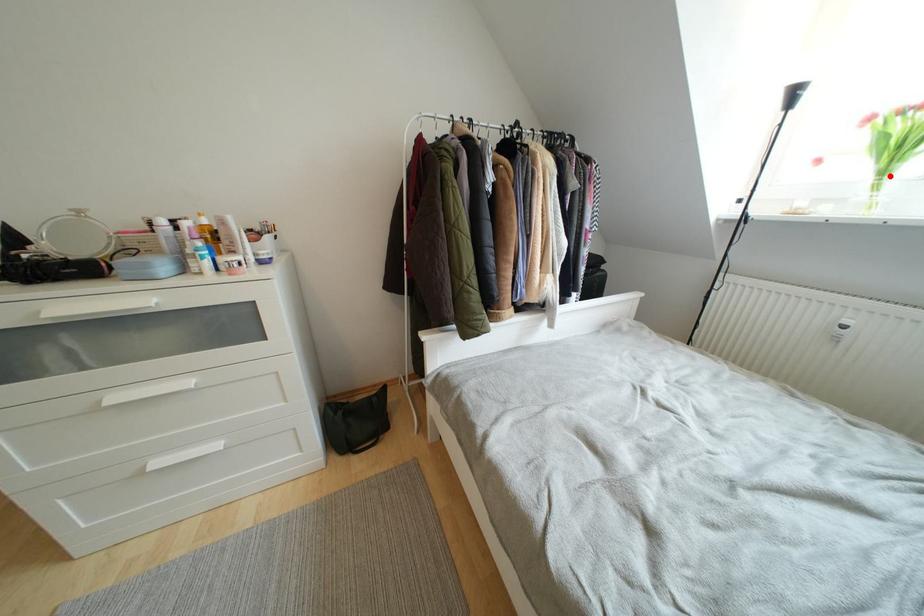
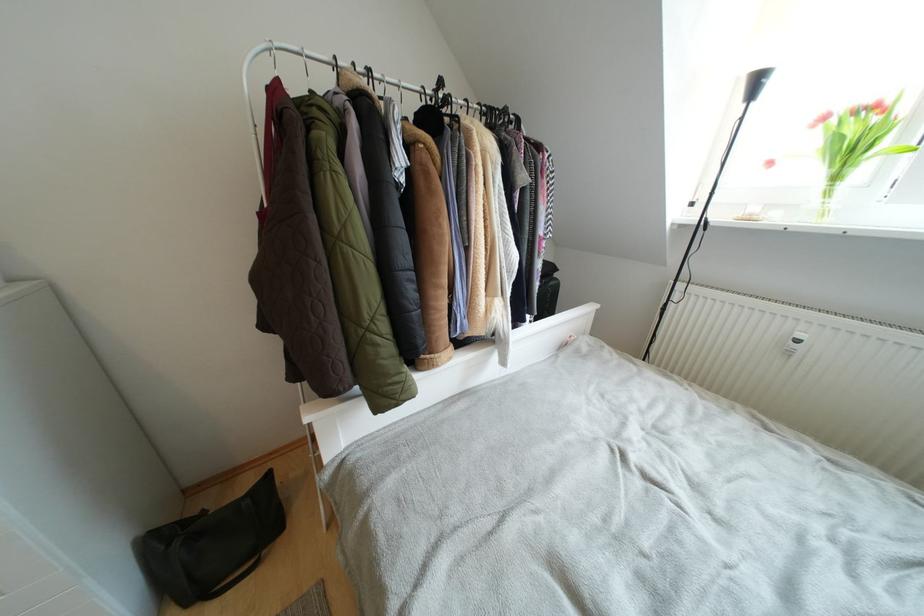
Question: I am providing you with two images of the same scene from different viewpoints. Image1 has a red point marked. In image2, the corresponding 3D location appears at what relative position? Reply with the corresponding letter.

Choices:
 (A) Closer
 (B) Farther

Answer: (A)